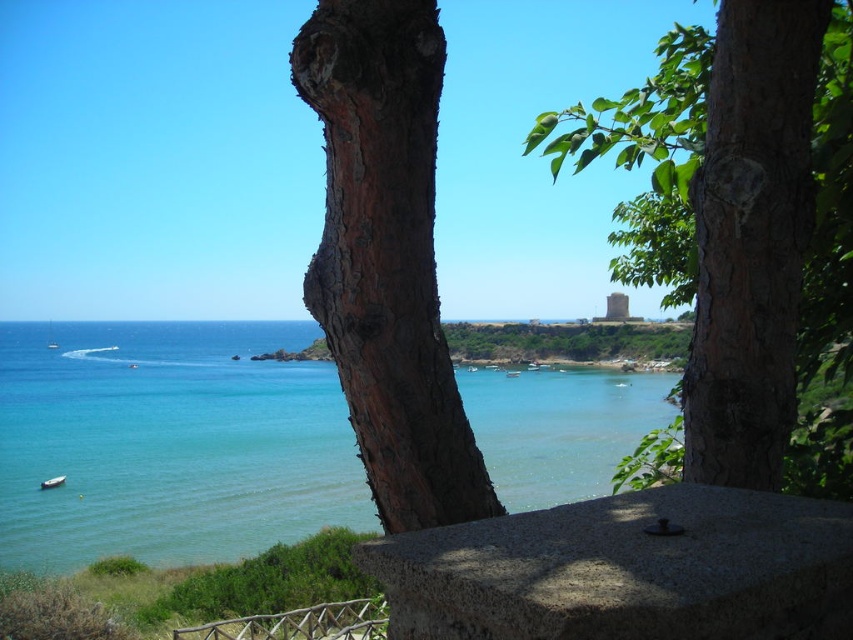
Does brown rough bark tree at center come behind gray stone balustrade at lower center?

That is True.

This screenshot has width=853, height=640. I want to click on brown rough bark tree at center, so click(744, 209).

The height and width of the screenshot is (640, 853). Identify the location of brown rough bark tree at center. (744, 209).

Who is shorter, brown rough bark tree at center or white plastic boat at lower left?

Standing shorter between the two is white plastic boat at lower left.

Is point (792, 93) behind point (56, 477)?

No, (792, 93) is closer to viewer.

You are a GUI agent. You are given a task and a screenshot of the screen. Output one action in this format:
    pyautogui.click(x=<x>, y=<y>)
    Task: Click on the brown rough bark tree at center
    The height and width of the screenshot is (640, 853).
    Given the screenshot: What is the action you would take?
    pyautogui.click(x=744, y=209)

Who is lower down, clear blue water at center or brown rough bark at center?

clear blue water at center is lower down.

Does point (196, 342) come behind point (355, 259)?

Yes, it is.

Where is `clear blue water at center`? clear blue water at center is located at coordinates (167, 444).